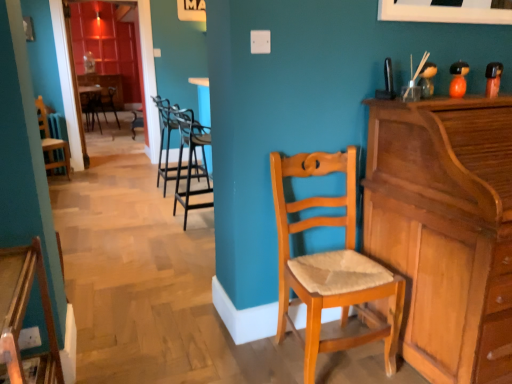
Where is `free space to the left of black metal barstools at center, acting as the fourth chair starting from the right`? Image resolution: width=512 pixels, height=384 pixels. free space to the left of black metal barstools at center, acting as the fourth chair starting from the right is located at coordinates (133, 191).